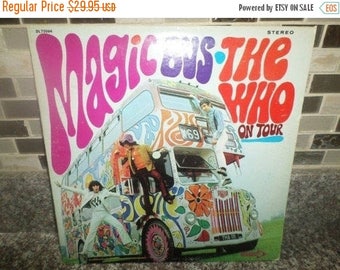
This screenshot has width=340, height=270. What are the coordinates of `window` in the screenshot? It's located at (113, 137).